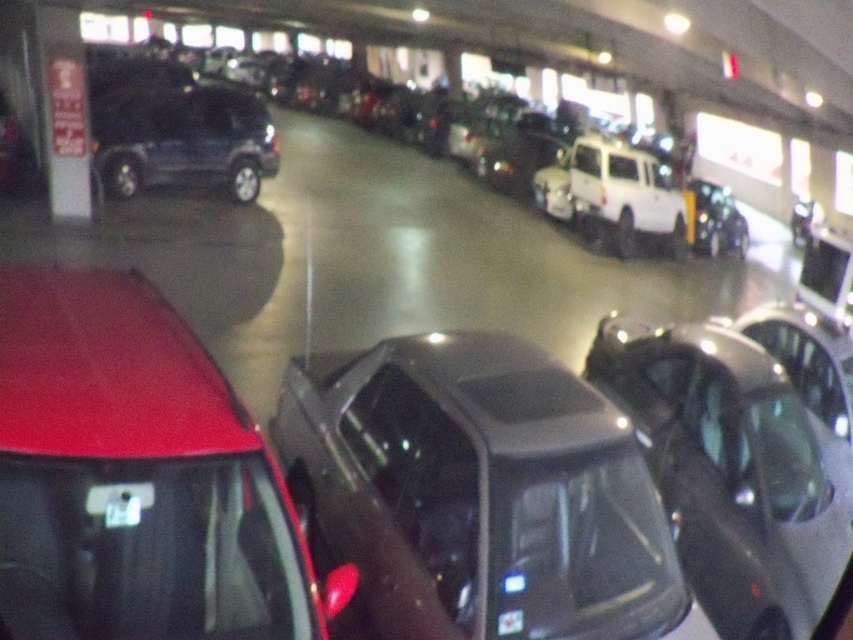
Can you confirm if shiny red car at lower left is smaller than matte black suv at center?

Actually, shiny red car at lower left might be larger than matte black suv at center.

Does shiny red car at lower left appear under matte black suv at center?

Correct, shiny red car at lower left is located below matte black suv at center.

Does point (148, 332) come behind point (219, 124)?

No, (148, 332) is in front of (219, 124).

Find the location of a particular element. This screenshot has height=640, width=853. shiny red car at lower left is located at coordinates (136, 476).

Is shiny black car at center to the right of matte black suv at center from the viewer's perspective?

Yes, shiny black car at center is to the right of matte black suv at center.

Which is in front, point (680, 400) or point (158, 148)?

Point (680, 400) is more forward.

Identify the location of shiny black car at center. (732, 470).

Is shiny red car at lower left to the right of shiny black car at center from the viewer's perspective?

In fact, shiny red car at lower left is to the left of shiny black car at center.

From the picture: Who is more forward, (138,314) or (746,445)?

Point (138,314) is more forward.

Which is behind, point (234, 522) or point (704, 433)?

The point (704, 433) is more distant.

Where is `shiny red car at lower left`? Image resolution: width=853 pixels, height=640 pixels. shiny red car at lower left is located at coordinates (136, 476).